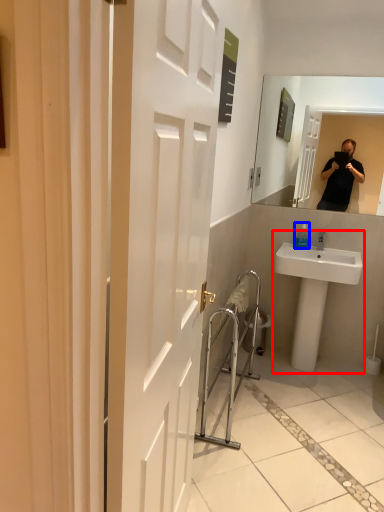
Question: Among these objects, which one is farthest to the camera, sink (highlighted by a red box) or bottle (highlighted by a blue box)?

Choices:
 (A) sink
 (B) bottle

Answer: (B)